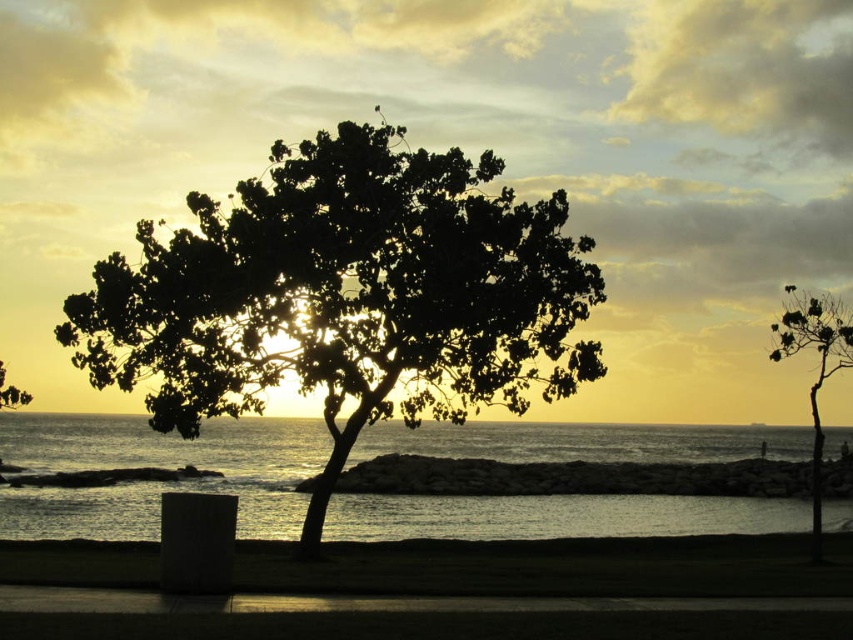
Question: Is the position of silhouette leafy tree at center less distant than that of silvery water at center?

Choices:
 (A) no
 (B) yes

Answer: (B)

Question: Which point is farther to the camera?

Choices:
 (A) green leafy tree at center
 (B) silhouette leafy tree at right
 (C) silvery water at center

Answer: (C)

Question: Can you confirm if silhouette leafy tree at right is positioned to the left of green leafy tree at center?

Choices:
 (A) yes
 (B) no

Answer: (B)

Question: Which point is farther to the camera?

Choices:
 (A) (163, 349)
 (B) (141, 417)
 (C) (817, 410)

Answer: (B)

Question: Where is silhouette leafy tree at center located in relation to silvery water at center in the image?

Choices:
 (A) left
 (B) right

Answer: (B)

Question: Which object is closer to the camera taking this photo?

Choices:
 (A) silvery water at center
 (B) green leafy tree at center
 (C) silhouette leafy tree at center

Answer: (C)